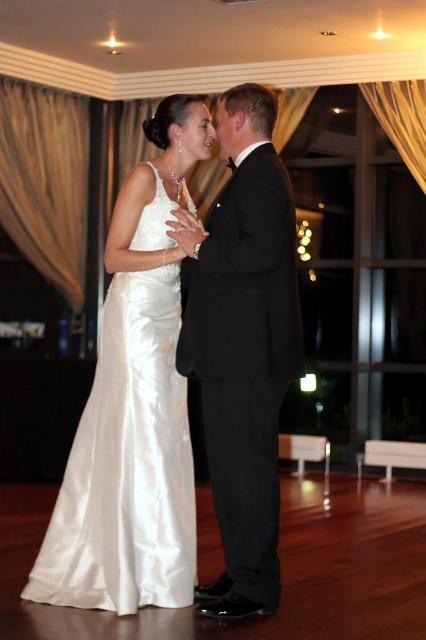
You are standing at the point labeled point (258,189) and want to move to the point labeled point (155,374). Which direction should you move in to get closer to the point?

You should move towards the point labeled point (155,374) because it is further away from the camera compared to your current position at point (258,189).